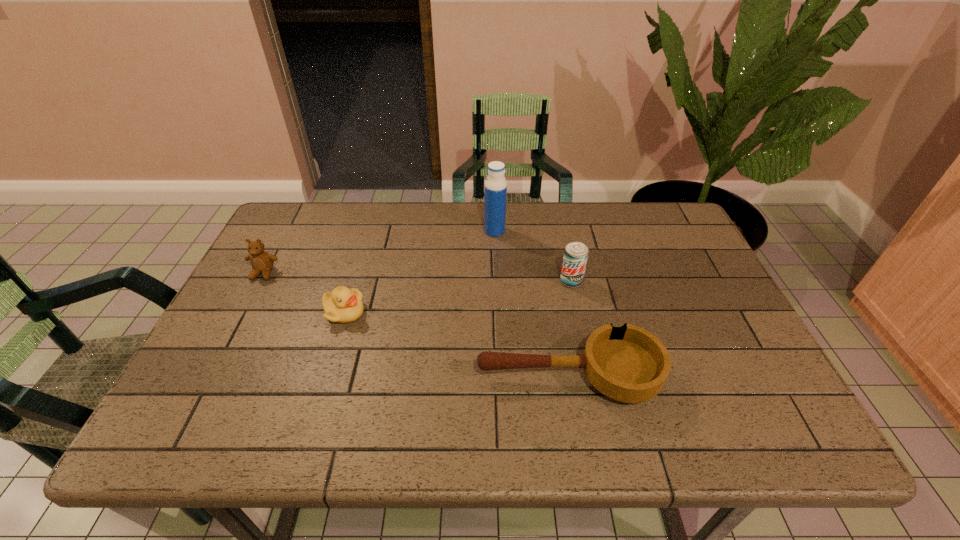
Where is `water bottle`? This screenshot has width=960, height=540. water bottle is located at coordinates (495, 185).

Find the location of a particular element. the farthest object is located at coordinates (495, 185).

The image size is (960, 540). In order to click on beer can in this screenshot , I will do `click(575, 257)`.

Where is `the leftmost object`? the leftmost object is located at coordinates (262, 262).

You are a GUI agent. You are given a task and a screenshot of the screen. Output one action in this format:
    pyautogui.click(x=<x>, y=<y>)
    Task: Click on the duckling
    The width and height of the screenshot is (960, 540).
    Given the screenshot: What is the action you would take?
    pyautogui.click(x=342, y=305)

In order to click on the fourth farthest object in this screenshot , I will do `click(342, 305)`.

Where is `the nearest object`? the nearest object is located at coordinates (629, 364).

Locate an element on the screen. This screenshot has width=960, height=540. free region located 0.130m on the right of the water bottle is located at coordinates tap(547, 231).

I want to click on vacant space situated 0.370m on the right of the beer can, so click(718, 281).

Where is `free space located 0.170m on the front-facing side of the leftmost object`? The height and width of the screenshot is (540, 960). free space located 0.170m on the front-facing side of the leftmost object is located at coordinates (233, 330).